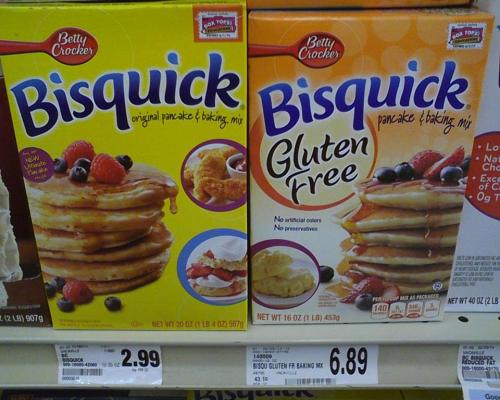
The image size is (500, 400). Identify the location of shelf. (265, 336), (380, 337), (484, 327), (16, 334).